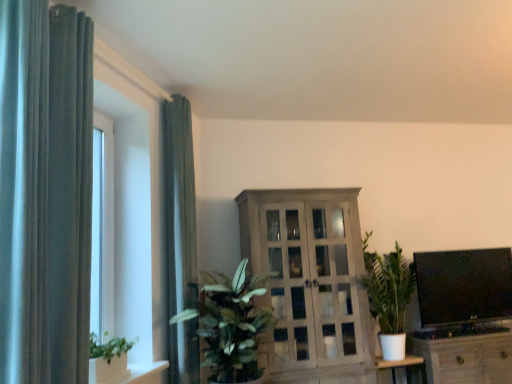
Question: Considering the positions of black glossy flat screen tv at right and wooden cabinet at lower right, which appears as the second cabinetry when viewed from the left, in the image, is black glossy flat screen tv at right taller or shorter than wooden cabinet at lower right, which appears as the second cabinetry when viewed from the left,?

Choices:
 (A) tall
 (B) short

Answer: (A)

Question: Is black glossy flat screen tv at right to the left or to the right of wooden cabinet at lower right, arranged as the 1th cabinetry when viewed from the right, in the image?

Choices:
 (A) left
 (B) right

Answer: (A)

Question: Estimate the real-world distances between objects in this image. Which object is farther from the green leafy plant at center?

Choices:
 (A) black glossy flat screen tv at right
 (B) matte gray curtain at left, the 2th curtain viewed from the front
 (C) white matte table at lower right
 (D) white glossy shelf at lower left
 (E) velvet dark green curtain at left, the 1th curtain when ordered from front to back

Answer: (A)

Question: Estimate the real-world distances between objects in this image. Which object is farther from the black glossy flat screen tv at right?

Choices:
 (A) white matte table at lower right
 (B) wooden cabinet at lower right, arranged as the 1th cabinetry when viewed from the right
 (C) wooden cabinet at center, acting as the first cabinetry starting from the left
 (D) green leafy plant at center
 (E) matte gray curtain at left, the 2th curtain viewed from the front

Answer: (E)